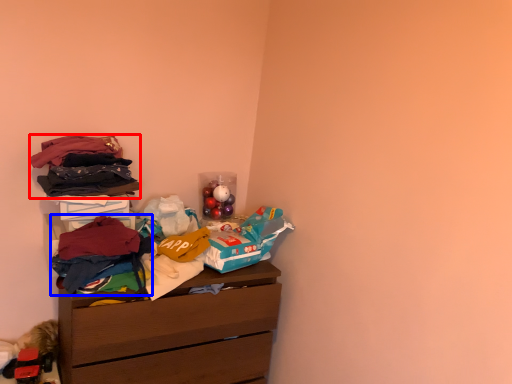
Question: Among these objects, which one is farthest to the camera, clothing (highlighted by a red box) or clothing (highlighted by a blue box)?

Choices:
 (A) clothing
 (B) clothing

Answer: (A)